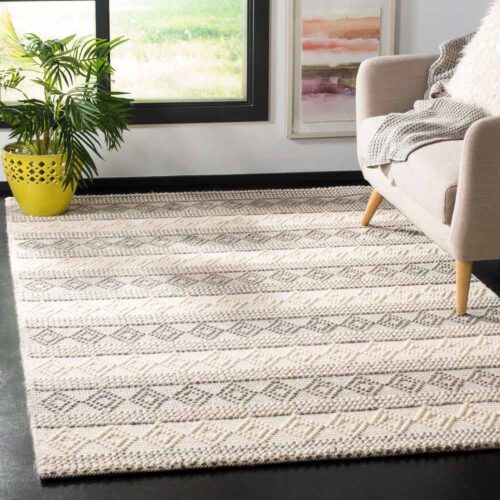
This screenshot has height=500, width=500. I want to click on diamond rows on rug, so click(x=164, y=436), click(x=152, y=397), click(x=139, y=362), click(x=122, y=308), click(x=112, y=283), click(x=104, y=261), click(x=100, y=243), click(x=94, y=224), click(x=87, y=209).